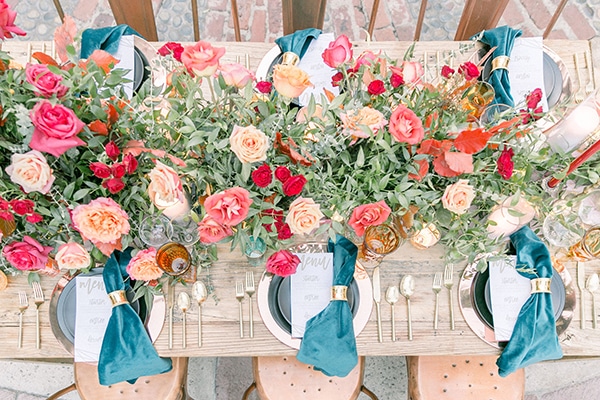
Locate an element on the screen. silver plates is located at coordinates (143, 58), (154, 311), (275, 308), (269, 57), (560, 70), (472, 302).